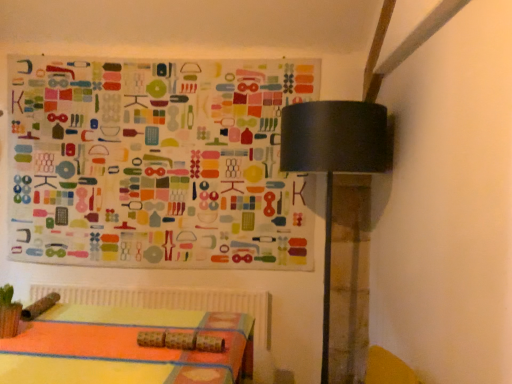
Identify the location of black matte table lamp at upper right. click(333, 159).

Measure the distance between point (384, 159) and camera.

Point (384, 159) is 1.96 meters away from camera.

The width and height of the screenshot is (512, 384). What do you see at coordinates (333, 159) in the screenshot?
I see `black matte table lamp at upper right` at bounding box center [333, 159].

I want to click on multicolored fabric at upper left, so click(x=156, y=163).

What do you see at coordinates (156, 163) in the screenshot? I see `multicolored fabric at upper left` at bounding box center [156, 163].

The image size is (512, 384). What are the coordinates of `black matte table lamp at upper right` in the screenshot? It's located at (333, 159).

From the picture: Is multicolored fabric at upper left to the right of black matte table lamp at upper right from the viewer's perspective?

No.

Which object is further away from the camera taking this photo, multicolored fabric at upper left or black matte table lamp at upper right?

Positioned behind is multicolored fabric at upper left.

Which is in front, point (56, 243) or point (334, 166)?

Point (334, 166)

From the image's perspective, is multicolored fabric at upper left on black matte table lamp at upper right?

Yes, from the image's perspective, multicolored fabric at upper left is on top of black matte table lamp at upper right.

From a real-world perspective, is multicolored fabric at upper left on top of black matte table lamp at upper right?

Yes, from a real-world perspective, multicolored fabric at upper left is above black matte table lamp at upper right.

Considering the sizes of objects multicolored fabric at upper left and black matte table lamp at upper right in the image provided, who is wider, multicolored fabric at upper left or black matte table lamp at upper right?

black matte table lamp at upper right.

Looking at this image, is multicolored fabric at upper left taller than black matte table lamp at upper right?

Incorrect, the height of multicolored fabric at upper left is not larger of that of black matte table lamp at upper right.

Which of these two, multicolored fabric at upper left or black matte table lamp at upper right, is bigger?

With larger size is black matte table lamp at upper right.

Is multicolored fabric at upper left surrounding black matte table lamp at upper right?

Definitely not — black matte table lamp at upper right is not inside multicolored fabric at upper left.

Is multicolored fabric at upper left far away from black matte table lamp at upper right?

No.

Is multicolored fabric at upper left positioned with its back to black matte table lamp at upper right?

No, multicolored fabric at upper left is not facing away from black matte table lamp at upper right.

What's the angular difference between multicolored fabric at upper left and black matte table lamp at upper right's facing directions?

They differ by 0.804 degrees in their facing directions.

The height and width of the screenshot is (384, 512). In order to click on bulletin board above the black matte table lamp at upper right (from a real-world perspective) in this screenshot , I will do `click(156, 163)`.

Is black matte table lamp at upper right at the right side of multicolored fabric at upper left?

Yes, black matte table lamp at upper right is to the right of multicolored fabric at upper left.

Considering the positions of objects black matte table lamp at upper right and multicolored fabric at upper left in the image provided, who is in front, black matte table lamp at upper right or multicolored fabric at upper left?

black matte table lamp at upper right is closer to the camera.

Does point (367, 125) appear closer or farther from the camera than point (297, 211)?

Point (367, 125) is closer to the camera than point (297, 211).

From the image's perspective, between black matte table lamp at upper right and multicolored fabric at upper left, who is located below?

From the image's view, black matte table lamp at upper right is below.

Consider the image. From a real-world perspective, which object rests below the other?

black matte table lamp at upper right.

Between black matte table lamp at upper right and multicolored fabric at upper left, which one has smaller width?

Thinner between the two is multicolored fabric at upper left.

Between black matte table lamp at upper right and multicolored fabric at upper left, which one has less height?

With less height is multicolored fabric at upper left.

Considering the sizes of objects black matte table lamp at upper right and multicolored fabric at upper left in the image provided, who is smaller, black matte table lamp at upper right or multicolored fabric at upper left?

multicolored fabric at upper left is smaller.

Which is correct: black matte table lamp at upper right is inside multicolored fabric at upper left, or outside of it?

black matte table lamp at upper right lies outside multicolored fabric at upper left.

Can you see black matte table lamp at upper right touching multicolored fabric at upper left?

There is a gap between black matte table lamp at upper right and multicolored fabric at upper left.

Does black matte table lamp at upper right turn towards multicolored fabric at upper left?

No, black matte table lamp at upper right is not aimed at multicolored fabric at upper left.

How different are the orientations of black matte table lamp at upper right and multicolored fabric at upper left in degrees?

There is a 0.804-degree angle between the facing directions of black matte table lamp at upper right and multicolored fabric at upper left.

The height and width of the screenshot is (384, 512). What are the coordinates of `bulletin board located behind the black matte table lamp at upper right` in the screenshot? It's located at (156, 163).

This screenshot has width=512, height=384. Identify the location of table lamp located on the right of multicolored fabric at upper left. (333, 159).

Image resolution: width=512 pixels, height=384 pixels. What are the coordinates of `bulletin board to the left of black matte table lamp at upper right` in the screenshot? It's located at (156, 163).